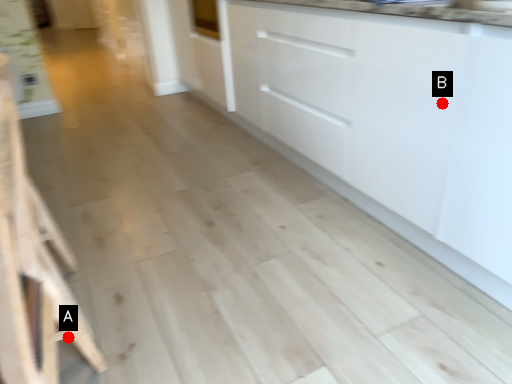
Question: Two points are circled on the image, labeled by A and B beside each circle. Which point is closer to the camera taking this photo?

Choices:
 (A) A is closer
 (B) B is closer

Answer: (A)